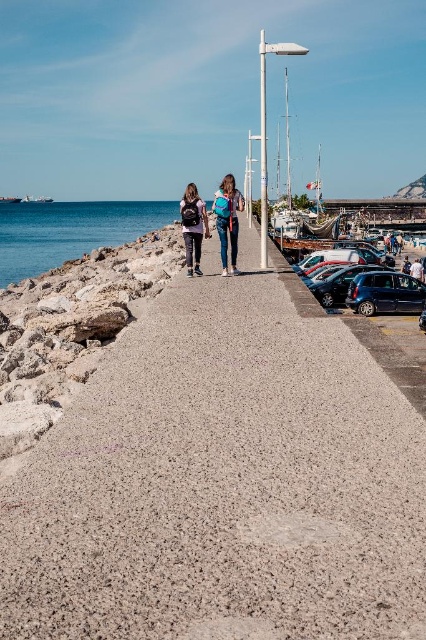
Question: Is matte black backpack at center to the right of shiny metallic car at right from the viewer's perspective?

Choices:
 (A) no
 (B) yes

Answer: (A)

Question: Which point is farther to the camera?

Choices:
 (A) satin black car at right
 (B) blue water at left
 (C) shiny metallic car at right
 (D) matte blue backpack at center

Answer: (B)

Question: Which object appears farthest from the camera in this image?

Choices:
 (A) denim jacket at center
 (B) satin black car at right

Answer: (A)

Question: Is satin black car at right thinner than denim jacket at center?

Choices:
 (A) yes
 (B) no

Answer: (A)

Question: Which point is farther from the camera taking this photo?

Choices:
 (A) (385, 240)
 (B) (382, 465)

Answer: (A)

Question: Can you confirm if matte black backpack at center is smaller than shiny metallic car at right?

Choices:
 (A) yes
 (B) no

Answer: (B)